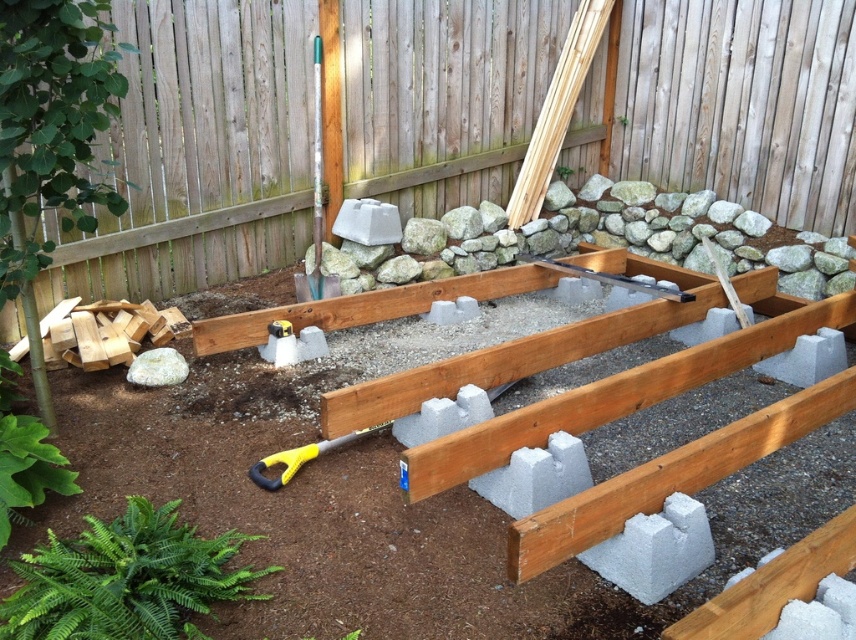
Question: Is wooden fence at upper center to the right of green plastic shovel at upper center from the viewer's perspective?

Choices:
 (A) no
 (B) yes

Answer: (B)

Question: Which object is farther from the camera taking this photo?

Choices:
 (A) green leafy fern at lower left
 (B) wooden fence at upper center

Answer: (B)

Question: Is wooden fence at upper center above green leafy fern at lower left?

Choices:
 (A) yes
 (B) no

Answer: (A)

Question: From the image, what is the correct spatial relationship of wooden fence at upper center in relation to yellow plastic shovel at lower center?

Choices:
 (A) above
 (B) below

Answer: (A)

Question: Which object appears farthest from the camera in this image?

Choices:
 (A) yellow plastic shovel at lower center
 (B) green leafy fern at lower left
 (C) wooden fence at upper center
 (D) green plastic shovel at upper center

Answer: (D)

Question: Which point is closer to the camera?

Choices:
 (A) yellow plastic shovel at lower center
 (B) wooden fence at upper center
 (C) green leafy fern at lower left

Answer: (C)